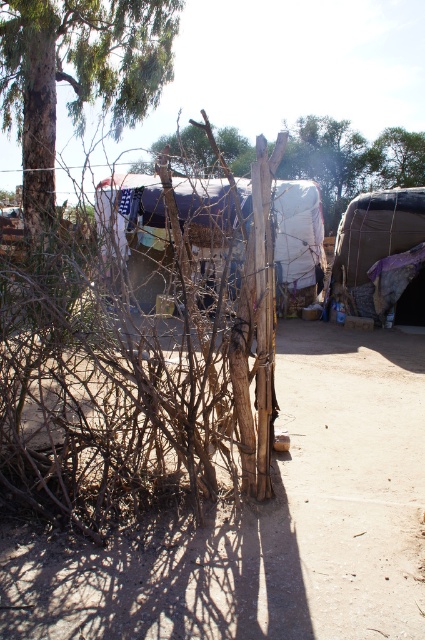
You are standing at the point marked by the coordinates point (382,253) in the image. What object are you currently positioned on?

The point (382,253) corresponds to the textured brown fabric tent at center, so you are positioned on the textured brown fabric tent at center.

You are a surveyor trying to locate the brown rough wood at center in a rural area. Using a coordinate system where the bottom left corner is the origin, can you determine its location based on the description?

The brown rough wood at center is located at coordinates point (351, 161).

You are standing in the rural outdoor scene described. There is a point labeled as point (351, 161). What object does this point correspond to?

The point (351, 161) corresponds to the brown rough wood at center.